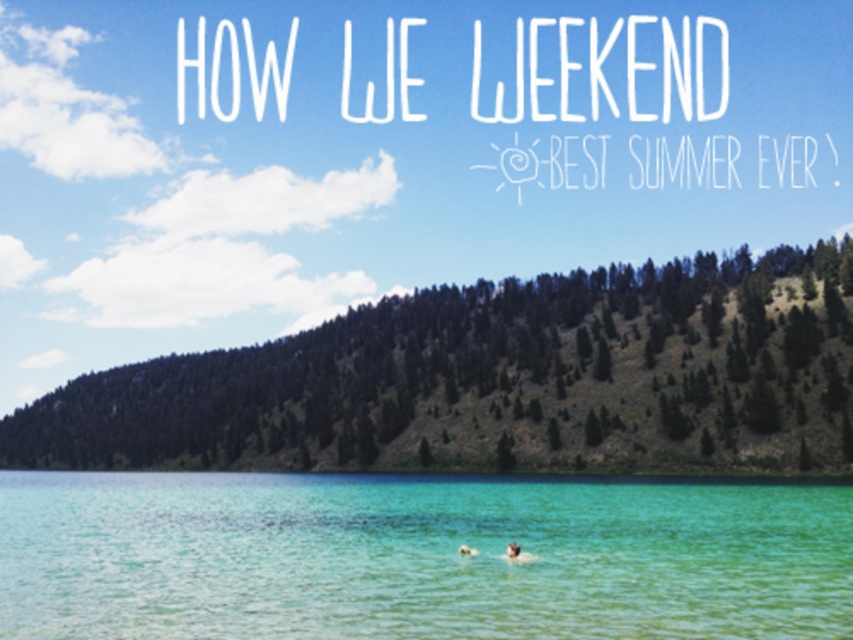
Between clear water at center and smooth skin person at center, which one is positioned lower?

Positioned lower is clear water at center.

Does point (137, 540) come in front of point (460, 547)?

No, it is behind (460, 547).

Find the location of a particular element. Image resolution: width=853 pixels, height=640 pixels. clear water at center is located at coordinates (416, 557).

You are a GUI agent. You are given a task and a screenshot of the screen. Output one action in this format:
    pyautogui.click(x=<x>, y=<y>)
    Task: Click on the clear water at center
    The image size is (853, 640).
    Given the screenshot: What is the action you would take?
    pyautogui.click(x=416, y=557)